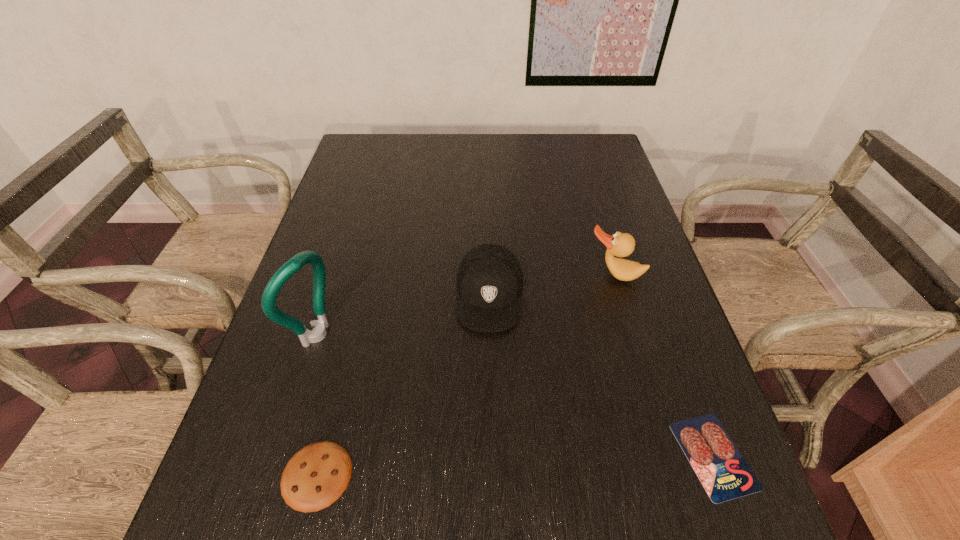
Locate an element on the screen. The width and height of the screenshot is (960, 540). object that can be found as the second closest to the salami is located at coordinates (620, 244).

Point out which object is positioned as the second nearest to the third object from right to left. Please provide its 2D coordinates. Your answer should be formatted as a tuple, i.e. [(x, y)], where the tuple contains the x and y coordinates of a point satisfying the conditions above.

[(285, 272)]

Image resolution: width=960 pixels, height=540 pixels. What are the coordinates of `free space that satisfies the following two spatial constraints: 1. on the back side of the fourth shortest object; 2. on the left side of the cookie` in the screenshot? It's located at (367, 274).

Identify the location of free location that satisfies the following two spatial constraints: 1. on the front side of the shortest object; 2. on the left side of the bottle opener. (277, 455).